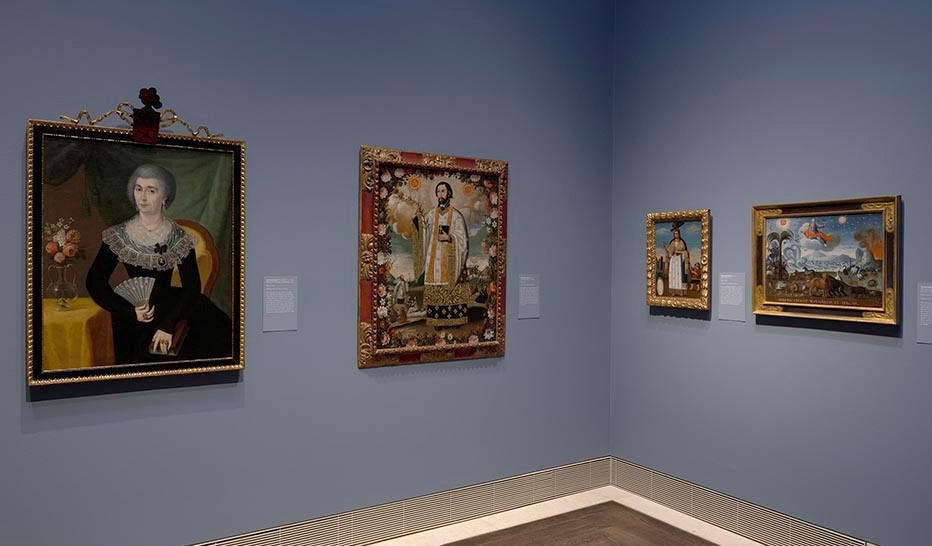
The width and height of the screenshot is (932, 546). In order to click on frames in this screenshot , I will do `click(240, 306)`, `click(502, 308)`, `click(703, 289)`, `click(885, 305)`.